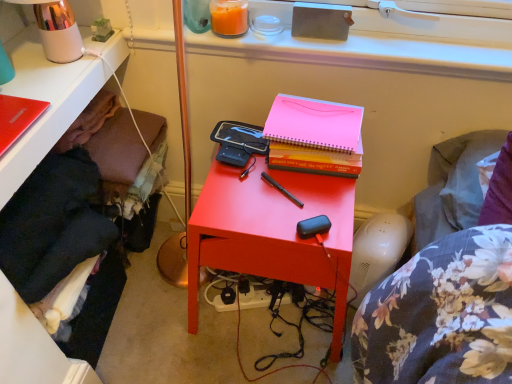
Question: Does orange wax candle at upper center have a lesser width compared to metallic pink table lamp at upper left?

Choices:
 (A) no
 (B) yes

Answer: (B)

Question: Is orange wax candle at upper center oriented towards metallic pink table lamp at upper left?

Choices:
 (A) yes
 (B) no

Answer: (B)

Question: Is the position of orange wax candle at upper center less distant than that of metallic pink table lamp at upper left?

Choices:
 (A) yes
 (B) no

Answer: (B)

Question: Can you see orange wax candle at upper center touching metallic pink table lamp at upper left?

Choices:
 (A) yes
 (B) no

Answer: (B)

Question: From the image's perspective, is orange wax candle at upper center over metallic pink table lamp at upper left?

Choices:
 (A) yes
 (B) no

Answer: (A)

Question: Is orange wax candle at upper center shorter than metallic pink table lamp at upper left?

Choices:
 (A) yes
 (B) no

Answer: (A)

Question: Does hardcover book at center have a smaller size compared to orange wax candle at upper center?

Choices:
 (A) no
 (B) yes

Answer: (A)

Question: Is hardcover book at center at the right side of orange wax candle at upper center?

Choices:
 (A) yes
 (B) no

Answer: (A)

Question: Does hardcover book at center have a larger size compared to orange wax candle at upper center?

Choices:
 (A) yes
 (B) no

Answer: (A)

Question: From a real-world perspective, is hardcover book at center on orange wax candle at upper center?

Choices:
 (A) yes
 (B) no

Answer: (B)

Question: Can you confirm if hardcover book at center is thinner than orange wax candle at upper center?

Choices:
 (A) yes
 (B) no

Answer: (B)

Question: Does hardcover book at center have a greater height compared to orange wax candle at upper center?

Choices:
 (A) no
 (B) yes

Answer: (B)

Question: Is matte red nightstand at center smaller than matte red notebook at upper left?

Choices:
 (A) no
 (B) yes

Answer: (A)